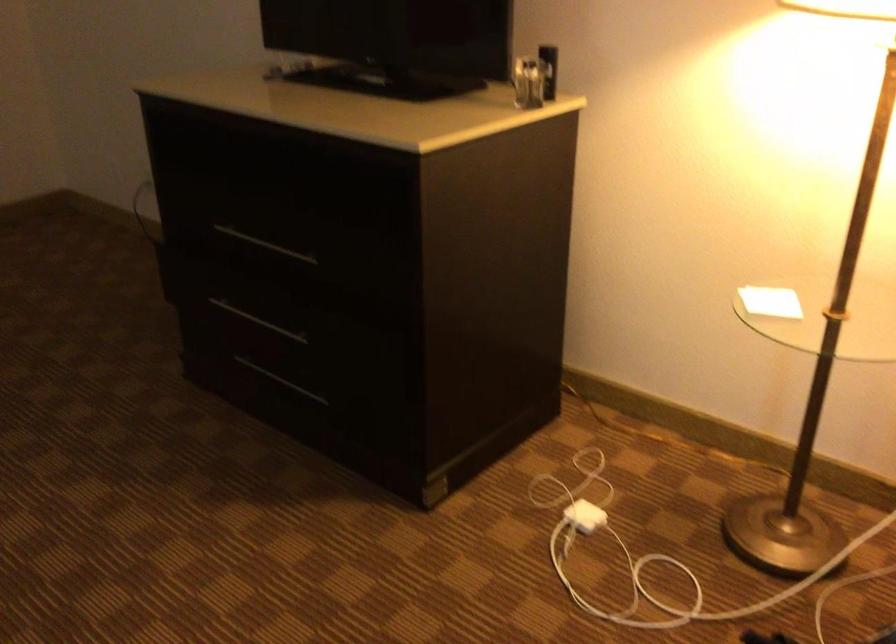
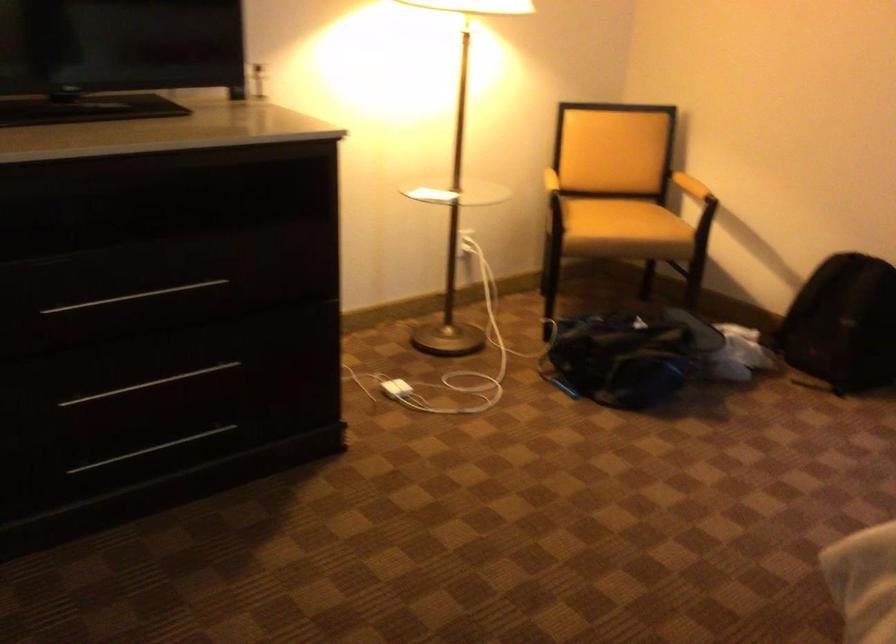
The point at (268,323) is marked in the first image. Where is the corresponding point in the second image?

(149, 384)